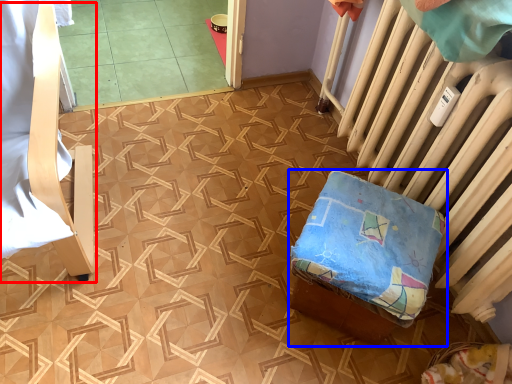
Question: Which of the following is the closest to the observer, furniture (highlighted by a red box) or furniture (highlighted by a blue box)?

Choices:
 (A) furniture
 (B) furniture

Answer: (A)